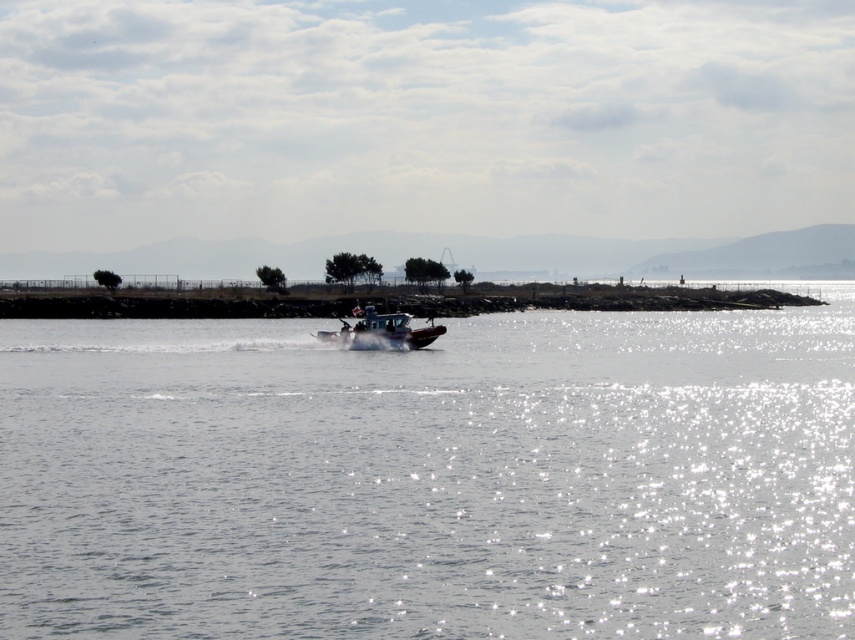
Between point (248, 604) and point (381, 316), which one is positioned behind?

Point (381, 316)

Looking at this image, who is taller, clear water at center or metallic gray boat at center?

clear water at center

Between point (783, 365) and point (397, 348), which one is positioned in front?

Positioned in front is point (783, 365).

This screenshot has width=855, height=640. Find the location of `clear water at center`. clear water at center is located at coordinates (431, 477).